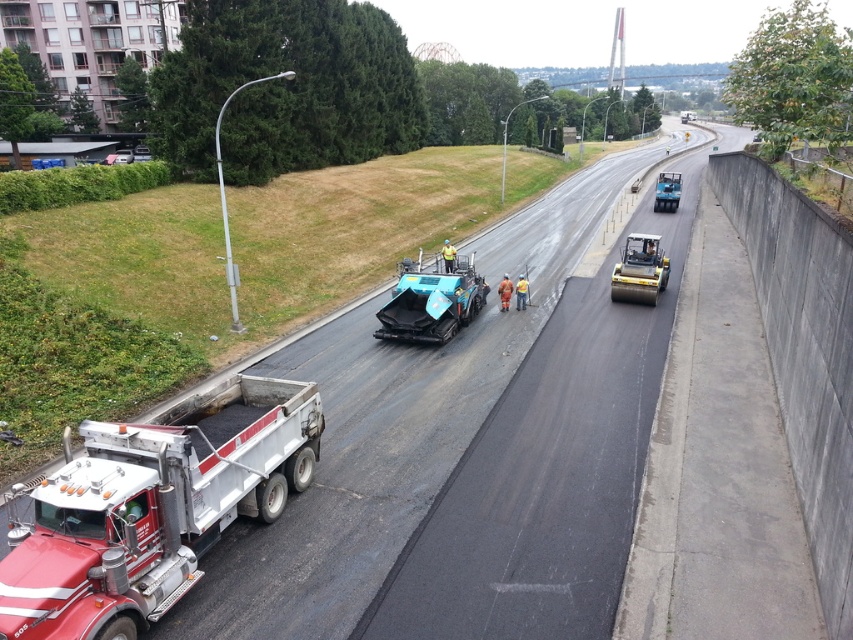
The image size is (853, 640). Describe the element at coordinates (401, 417) in the screenshot. I see `black asphalt road at center` at that location.

I want to click on black asphalt road at center, so click(401, 417).

Who is more distant from viewer, (294, 595) or (149, 621)?

The point (294, 595) is more distant.

This screenshot has height=640, width=853. Identify the location of black asphalt road at center. (401, 417).

At what (x,y) coordinates should I click in order to perform the action: click on black asphalt road at center. Please return your answer as a coordinate pair (x, y). Looking at the image, I should click on (401, 417).

The height and width of the screenshot is (640, 853). Find the location of `black asphalt road at center`. black asphalt road at center is located at coordinates (401, 417).

Find the location of a particular element. red metallic dump truck at lower left is located at coordinates (152, 506).

Between red metallic dump truck at lower left and teal rubber asphalt spreader at center, which one is positioned lower?

red metallic dump truck at lower left is lower down.

Measure the distance between red metallic dump truck at lower left and camera.

red metallic dump truck at lower left is 7.29 meters away from camera.

Where is `red metallic dump truck at lower left`? The width and height of the screenshot is (853, 640). red metallic dump truck at lower left is located at coordinates (152, 506).